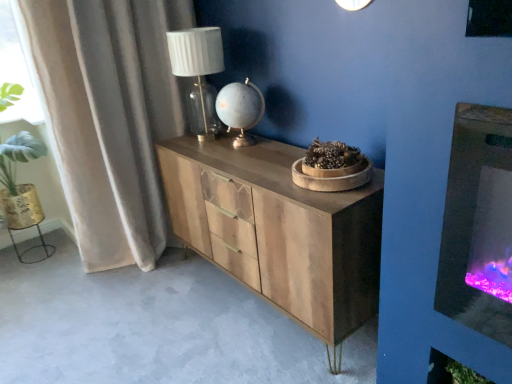
Question: From the image's perspective, relative to matte white glass table lamp at upper center, is velvet beige curtain at left above or below?

Choices:
 (A) below
 (B) above

Answer: (A)

Question: Considering their positions, is velvet beige curtain at left located in front of or behind matte white glass table lamp at upper center?

Choices:
 (A) behind
 (B) front

Answer: (B)

Question: Which is nearer to the wooden chest of drawers at center?

Choices:
 (A) velvet beige curtain at left
 (B) matte white glass table lamp at upper center

Answer: (B)

Question: Based on their relative distances, which object is farther from the velvet beige curtain at left?

Choices:
 (A) wooden chest of drawers at center
 (B) matte white glass table lamp at upper center

Answer: (A)